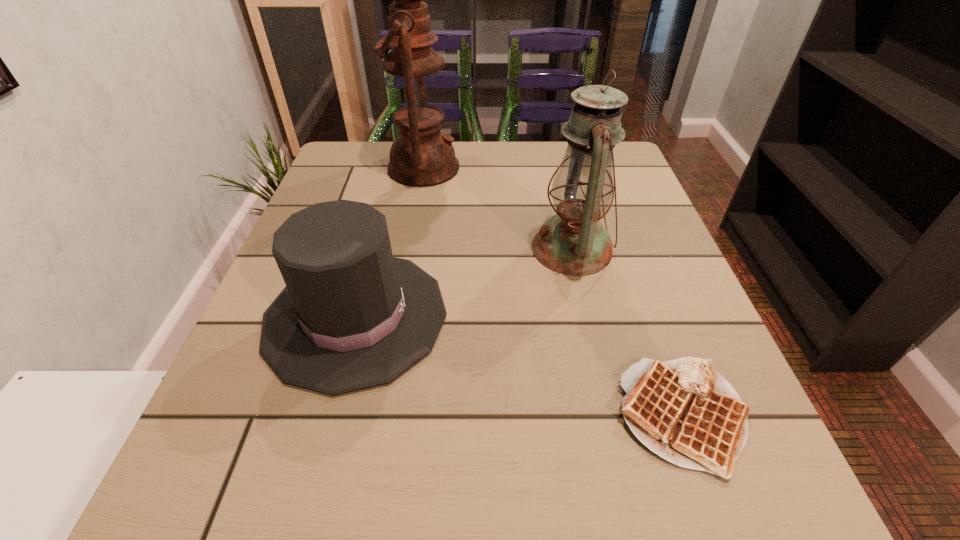
You are a GUI agent. You are given a task and a screenshot of the screen. Output one action in this format:
    pyautogui.click(x=<x>, y=<y>)
    Task: Click on the free location at the right edge of the desktop
    
    Given the screenshot: What is the action you would take?
    pyautogui.click(x=628, y=330)

This screenshot has height=540, width=960. What are the coordinates of `vacant point at the far left corner` in the screenshot? It's located at (386, 159).

Locate an element on the screen. This screenshot has height=540, width=960. vacant region at the near left corner of the desktop is located at coordinates (256, 525).

The width and height of the screenshot is (960, 540). Identify the location of free point at the far right corner. (615, 148).

Locate an element on the screen. Image resolution: width=960 pixels, height=540 pixels. vacant area that lies between the shortest object and the left oil lamp is located at coordinates (553, 292).

Where is `free space that is in between the shortest object and the farther oil lamp`? This screenshot has width=960, height=540. free space that is in between the shortest object and the farther oil lamp is located at coordinates (553, 292).

Identify the location of free space between the shortest object and the right oil lamp. The image size is (960, 540). (627, 332).

Find the location of a particular element. empty location between the nearer oil lamp and the waffle is located at coordinates (627, 332).

In order to click on vacant space that is in between the waffle and the third tallest object in this screenshot , I will do `click(519, 367)`.

Locate an element on the screen. The image size is (960, 540). free space between the second shortest object and the right oil lamp is located at coordinates (464, 283).